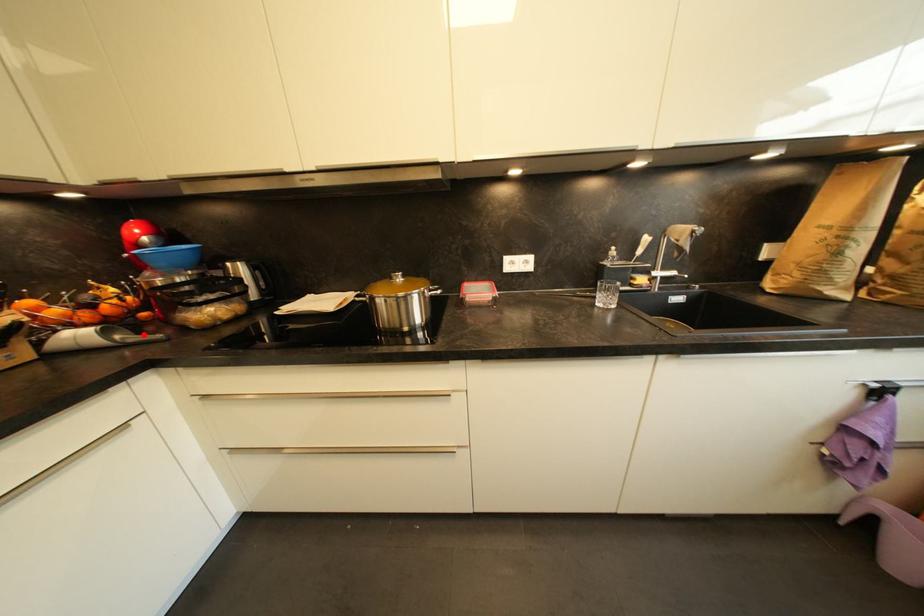
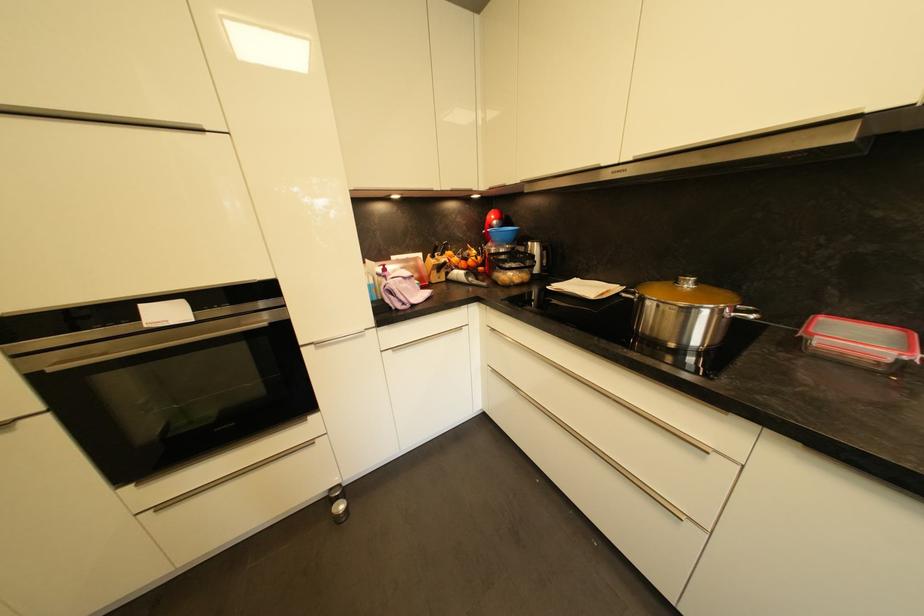
Locate, in the second image, the point that corresponds to the highlighted location in the first image.

(481, 281)